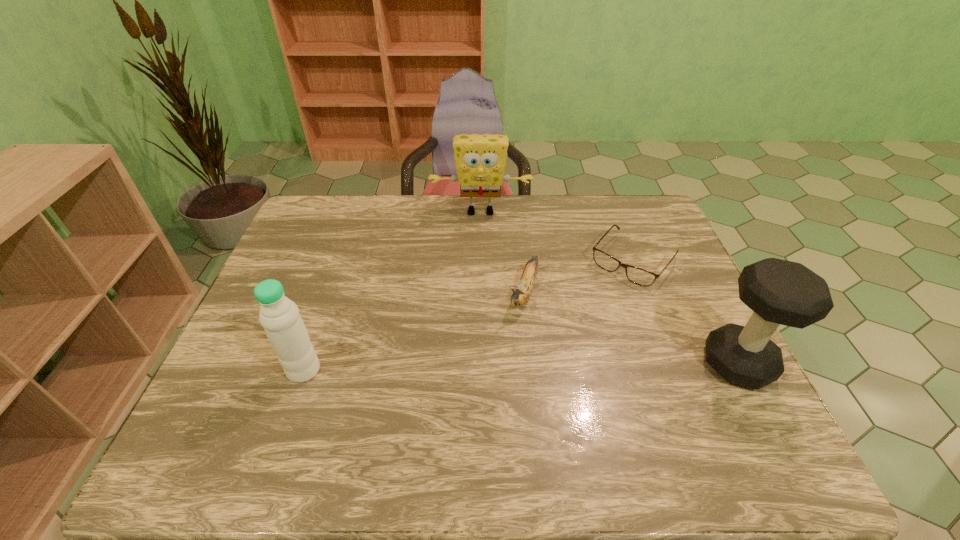
Find the location of a particular element. dumbbell positioned at the right edge is located at coordinates (782, 292).

The image size is (960, 540). In order to click on spectacles that is at the right edge in this screenshot , I will do `click(639, 276)`.

This screenshot has width=960, height=540. Identify the location of object present at the far right corner. (x=639, y=276).

Where is `object located in the near right corner section of the desktop`? The image size is (960, 540). object located in the near right corner section of the desktop is located at coordinates (782, 292).

Where is `vacant space at the far edge of the desktop`? vacant space at the far edge of the desktop is located at coordinates (595, 198).

You are a GUI agent. You are given a task and a screenshot of the screen. Output one action in this format:
    pyautogui.click(x=<x>, y=<y>)
    Task: Click on the blank space at the near edge
    
    Given the screenshot: What is the action you would take?
    pyautogui.click(x=534, y=392)

The height and width of the screenshot is (540, 960). In order to click on vacant region at the left edge of the desktop in this screenshot , I will do `click(225, 364)`.

The image size is (960, 540). What are the coordinates of `free location at the right edge` in the screenshot? It's located at (709, 319).

Where is `vacant space at the far left corner of the desktop`? vacant space at the far left corner of the desktop is located at coordinates (313, 221).

Identify the location of vacant region at the near left corner of the desktop. (246, 415).